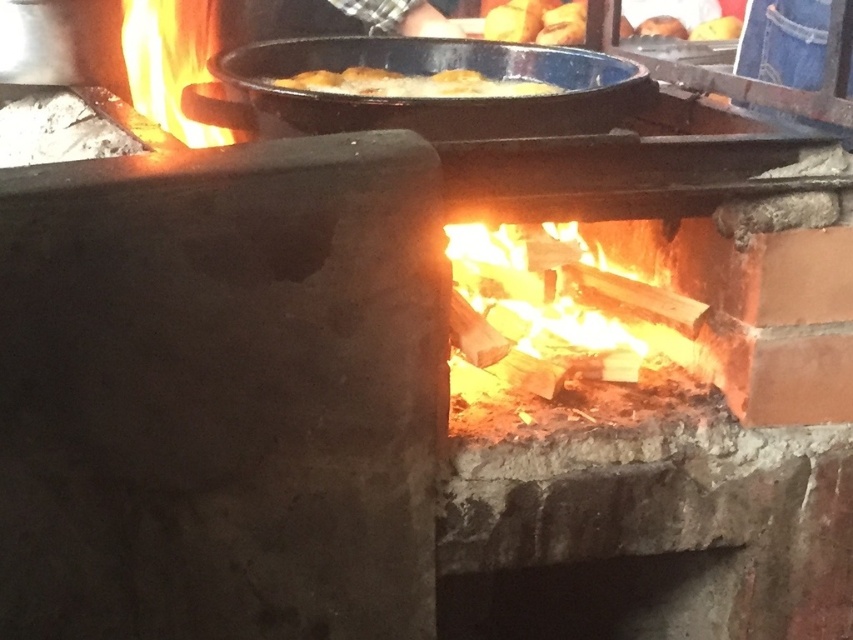
Question: Is charcoal wood fire at center to the left of blue enameled cast iron wok at upper center from the viewer's perspective?

Choices:
 (A) yes
 (B) no

Answer: (B)

Question: Does charcoal wood fire at center appear over golden crispy bread at upper center?

Choices:
 (A) yes
 (B) no

Answer: (B)

Question: Does charcoal wood fire at center appear under blue enameled cast iron wok at upper center?

Choices:
 (A) yes
 (B) no

Answer: (A)

Question: Which object appears farthest from the camera in this image?

Choices:
 (A) charcoal wood fire at center
 (B) golden crispy bread at upper center
 (C) blue enameled cast iron wok at upper center

Answer: (B)

Question: Based on their relative distances, which object is nearer to the charcoal wood fire at center?

Choices:
 (A) golden crispy bread at upper center
 (B) blue enameled cast iron wok at upper center

Answer: (B)

Question: Estimate the real-world distances between objects in this image. Which object is farther from the charcoal wood fire at center?

Choices:
 (A) golden crispy bread at upper center
 (B) blue enameled cast iron wok at upper center

Answer: (A)